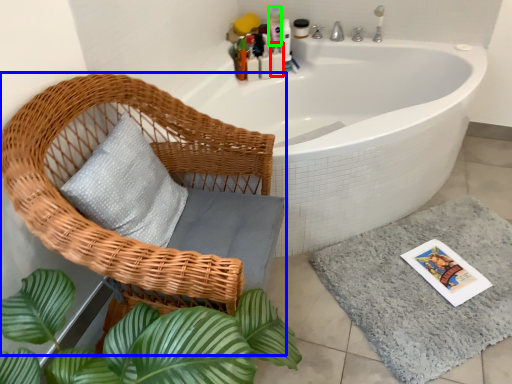
Question: Which object is positioned farthest from toiletry (highlighted by a red box)? Select from chair (highlighted by a blue box) and toiletry (highlighted by a green box).

Choices:
 (A) chair
 (B) toiletry

Answer: (A)